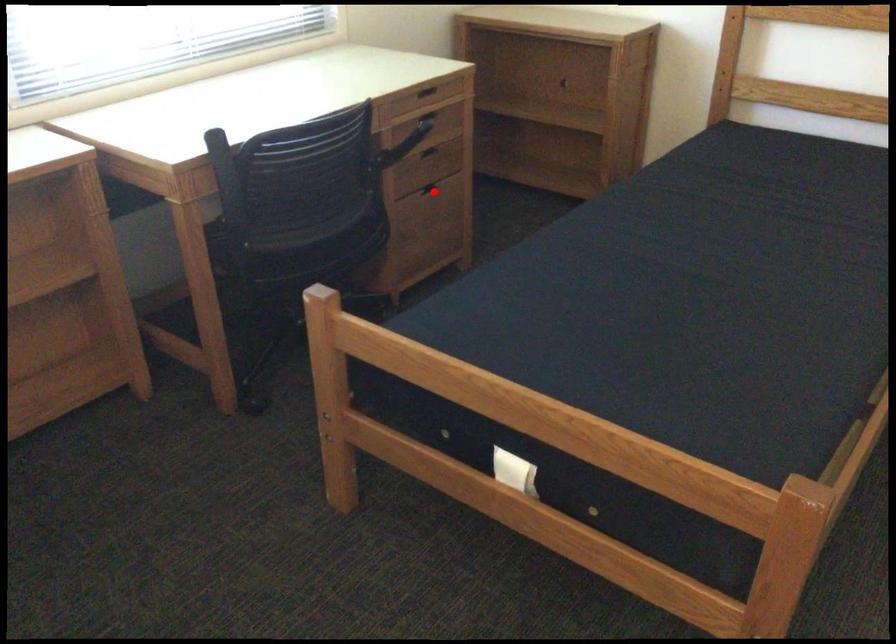
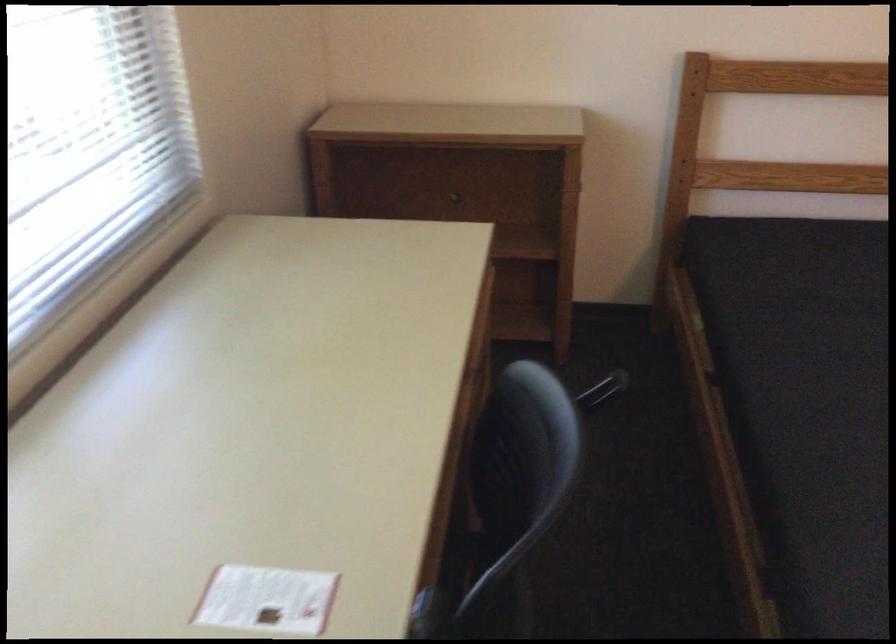
Question: I am providing you with two images of the same scene from different viewpoints. A red point is marked on the first image. Can you still see the location of the red point in image 2?

Choices:
 (A) Yes
 (B) No

Answer: (B)